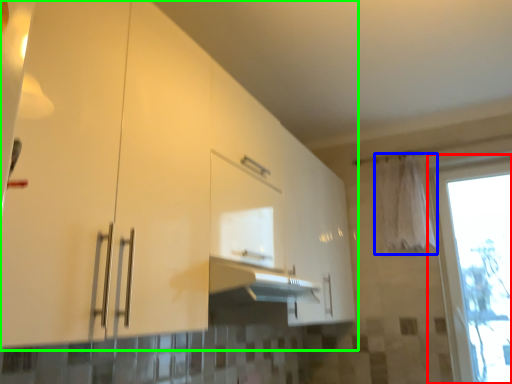
Question: Estimate the real-world distances between objects in this image. Which object is farther from window (highlighted by a red box), curtain (highlighted by a blue box) or cabinetry (highlighted by a green box)?

Choices:
 (A) curtain
 (B) cabinetry

Answer: (B)